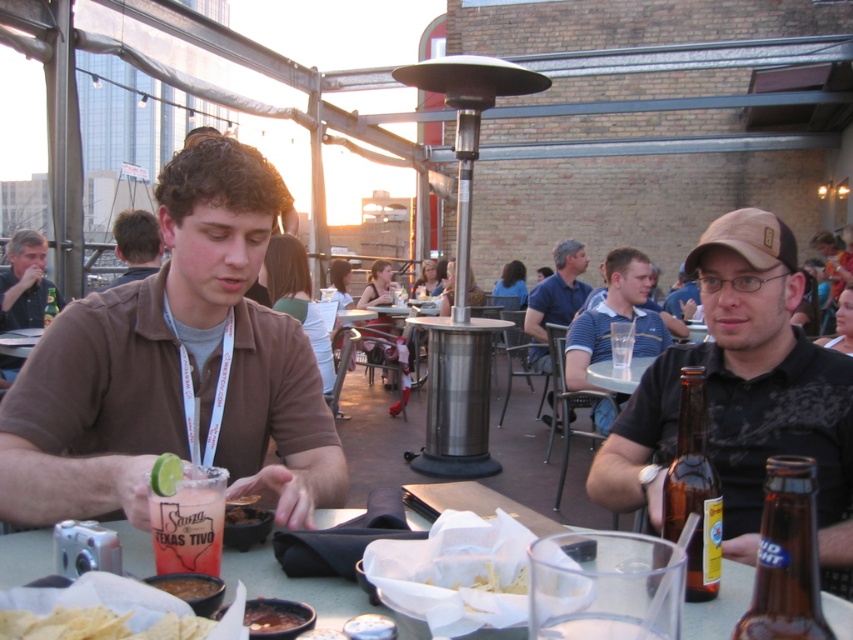
Question: Can you confirm if blue striped shirt at center is positioned above brown leather jacket at upper left?

Choices:
 (A) no
 (B) yes

Answer: (A)

Question: Does brown glass bottle at lower right appear on the right side of brown leather jacket at upper left?

Choices:
 (A) yes
 (B) no

Answer: (A)

Question: Can you confirm if clear glass at center is positioned below smooth brown tortilla chips at center?

Choices:
 (A) no
 (B) yes

Answer: (B)

Question: Which object is the closest to the brown glass bottle at lower right?

Choices:
 (A) translucent glass margarita at center
 (B) brown glass beer bottle at lower right

Answer: (B)

Question: Which object appears farthest from the camera in this image?

Choices:
 (A) brown glass beer bottle at lower right
 (B) blue cotton shirt at center
 (C) brown leather jacket at upper left
 (D) smooth brown tortilla chips at lower left

Answer: (B)

Question: Among these points, which one is nearest to the camera?

Choices:
 (A) (706, 474)
 (B) (144, 273)

Answer: (A)